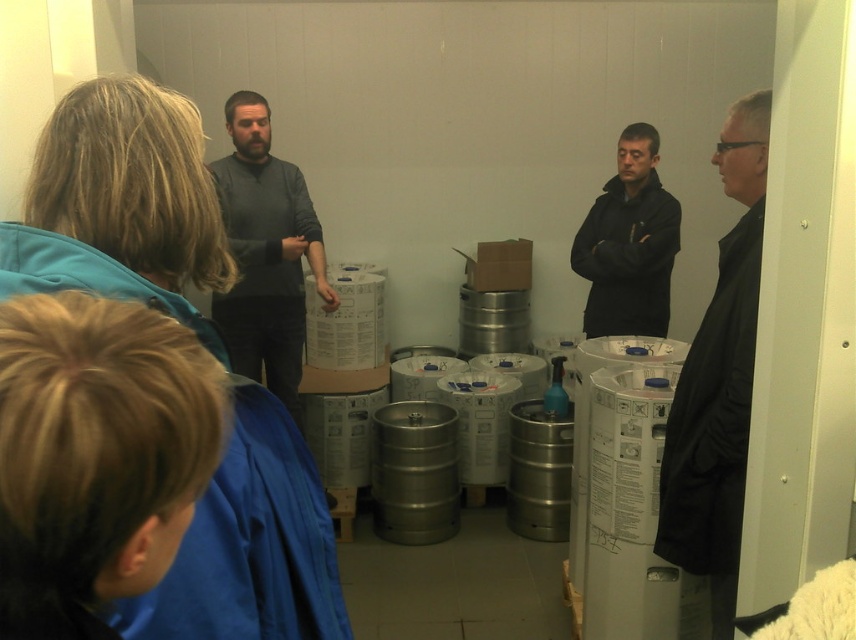
Can you confirm if dark gray sweater at center is wider than black matte jacket at center?

Indeed, dark gray sweater at center has a greater width compared to black matte jacket at center.

Between point (236, 113) and point (595, 225), which one is positioned in front?

Point (236, 113) is in front.

Where is `dark gray sweater at center`? The height and width of the screenshot is (640, 856). dark gray sweater at center is located at coordinates (265, 252).

Image resolution: width=856 pixels, height=640 pixels. What are the coordinates of `black matte coat at right` in the screenshot? It's located at (718, 384).

Does black matte coat at right appear over dark gray sweater at center?

No, black matte coat at right is not above dark gray sweater at center.

Where is `black matte coat at right`? black matte coat at right is located at coordinates (718, 384).

Is black matte coat at right to the left of black matte jacket at center from the viewer's perspective?

Yes, black matte coat at right is to the left of black matte jacket at center.

The image size is (856, 640). Find the location of `black matte coat at right`. black matte coat at right is located at coordinates (718, 384).

Is point (746, 452) closer to viewer compared to point (654, 225)?

Yes, it is in front of point (654, 225).

The height and width of the screenshot is (640, 856). I want to click on black matte coat at right, so click(x=718, y=384).